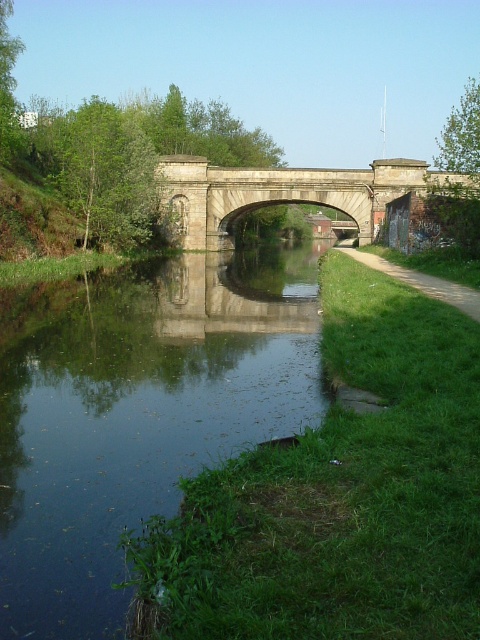
You are a tourist standing on the stone bridge at center and want to take a photo of the green reflective water at center. In which direction should you point your camera to capture the water?

You should point your camera to the left of the stone bridge at center to capture the green reflective water at center, as it is located to the left of the bridge.

You are a tourist standing on the left bank of the canal and want to cross to the right bank. The stone bridge at center and the green grassy path at right are visible. Which one is closer to your current position?

The stone bridge at center is closer to your current position because it is to the left of the green grassy path at right, meaning it is nearer to the left bank where you are standing.

You are standing on the stone bridge and want to locate the green reflective water at center. According to the coordinates provided, where exactly would you find it?

The green reflective water at center is located at coordinates point (x=141, y=417).